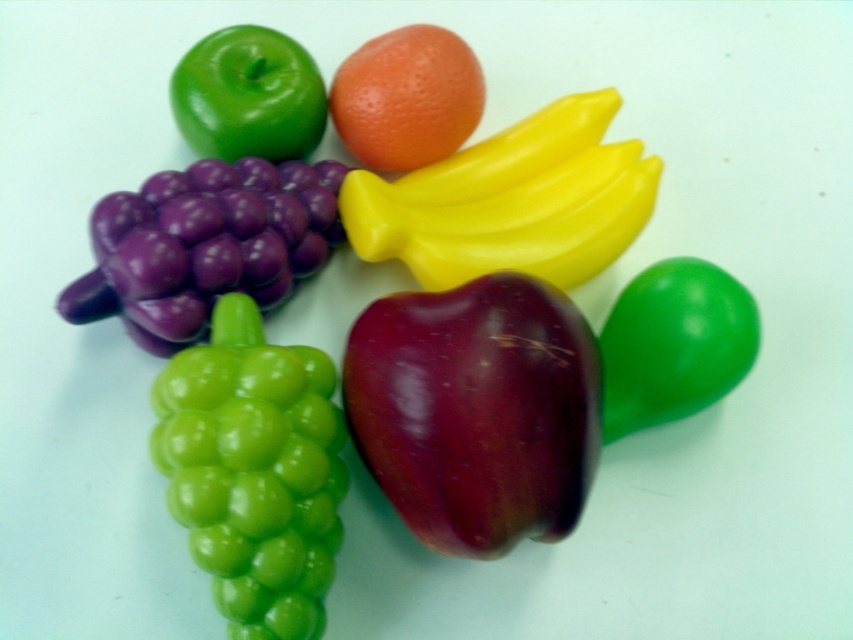
Can you confirm if yellow matte bananas at upper center is positioned to the left of glossy green apple at upper left?

Incorrect, yellow matte bananas at upper center is not on the left side of glossy green apple at upper left.

Can you confirm if yellow matte bananas at upper center is thinner than glossy green apple at upper left?

No, yellow matte bananas at upper center is not thinner than glossy green apple at upper left.

Is point (587, 154) closer to viewer compared to point (270, 145)?

No, it is behind (270, 145).

Where is `yellow matte bananas at upper center`? The image size is (853, 640). yellow matte bananas at upper center is located at coordinates (511, 202).

Is point (136, 246) farther from camera compared to point (253, 154)?

No, (136, 246) is closer to viewer.

This screenshot has height=640, width=853. Identify the location of purple glossy grapes at left. (204, 244).

Measure the distance between point (305, 173) and camera.

Point (305, 173) is 1.37 meters from camera.

The width and height of the screenshot is (853, 640). In order to click on purple glossy grapes at left in this screenshot , I will do `click(204, 244)`.

Is point (244, 200) less distant than point (413, 24)?

Yes, point (244, 200) is closer to viewer.

Does purple glossy grapes at left have a lesser width compared to orange matte at center?

In fact, purple glossy grapes at left might be wider than orange matte at center.

I want to click on purple glossy grapes at left, so click(204, 244).

At what (x,y) coordinates should I click in order to perform the action: click on purple glossy grapes at left. Please return your answer as a coordinate pair (x, y). Looking at the image, I should click on (204, 244).